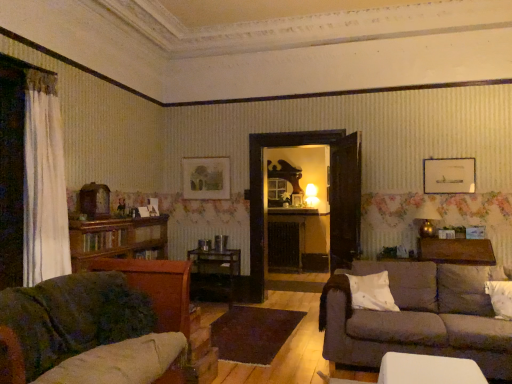
Question: Which direction should I rotate to look at matte wooden picture frame at upper center, the 2th picture frame positioned from the right?

Choices:
 (A) right
 (B) left

Answer: (B)

Question: Should I look upward or downward to see velvet green couch at lower left, the 2th studio couch in the right-to-left sequence?

Choices:
 (A) up
 (B) down

Answer: (B)

Question: Is velvet green couch at lower left, which is the first studio couch from front to back, positioned in front of white fabric pillow at lower right, which is counted as the second pillow, starting from the left?

Choices:
 (A) yes
 (B) no

Answer: (A)

Question: Is velvet green couch at lower left, arranged as the first studio couch when viewed from the left, not near white fabric pillow at lower right, the 1th pillow viewed from the right?

Choices:
 (A) no
 (B) yes

Answer: (B)

Question: Would you say white fabric pillow at lower right, which is counted as the second pillow, starting from the left, is part of velvet green couch at lower left, arranged as the 2th studio couch when viewed from the back,'s contents?

Choices:
 (A) yes
 (B) no

Answer: (B)

Question: Can you confirm if velvet green couch at lower left, arranged as the first studio couch when viewed from the left, is smaller than white fabric pillow at lower right, which is counted as the second pillow, starting from the left?

Choices:
 (A) yes
 (B) no

Answer: (B)

Question: Considering the relative sizes of velvet green couch at lower left, the 2th studio couch in the right-to-left sequence, and white fabric pillow at lower right, which is counted as the second pillow, starting from the left, in the image provided, is velvet green couch at lower left, the 2th studio couch in the right-to-left sequence, wider than white fabric pillow at lower right, which is counted as the second pillow, starting from the left,?

Choices:
 (A) no
 (B) yes

Answer: (B)

Question: Is velvet green couch at lower left, which is the first studio couch from front to back, at the left side of white fabric pillow at lower right, the 1th pillow viewed from the right?

Choices:
 (A) no
 (B) yes

Answer: (B)

Question: From the image's perspective, does matte white picture frame at upper right, which ranks as the second picture frame in back-to-front order, appear higher than velvet green couch at lower left, the 2th studio couch in the right-to-left sequence?

Choices:
 (A) yes
 (B) no

Answer: (A)

Question: Is matte white picture frame at upper right, which is the 1th picture frame in right-to-left order, positioned with its back to velvet green couch at lower left, arranged as the first studio couch when viewed from the left?

Choices:
 (A) no
 (B) yes

Answer: (A)

Question: Considering the relative sizes of matte white picture frame at upper right, which ranks as the second picture frame in back-to-front order, and velvet green couch at lower left, arranged as the 2th studio couch when viewed from the back, in the image provided, is matte white picture frame at upper right, which ranks as the second picture frame in back-to-front order, taller than velvet green couch at lower left, arranged as the 2th studio couch when viewed from the back,?

Choices:
 (A) no
 (B) yes

Answer: (A)

Question: Would you consider matte white picture frame at upper right, which is the 1th picture frame in right-to-left order, to be distant from velvet green couch at lower left, arranged as the first studio couch when viewed from the left?

Choices:
 (A) yes
 (B) no

Answer: (A)

Question: From the image's perspective, would you say matte white picture frame at upper right, the second picture frame from the left, is shown under velvet green couch at lower left, the 2th studio couch in the right-to-left sequence?

Choices:
 (A) yes
 (B) no

Answer: (B)

Question: From a real-world perspective, is matte white picture frame at upper right, the second picture frame from the left, on velvet green couch at lower left, arranged as the first studio couch when viewed from the left?

Choices:
 (A) yes
 (B) no

Answer: (A)

Question: Is velvet green couch at lower left, arranged as the 2th studio couch when viewed from the back, located outside white matte pillow at center, the second pillow positioned from the right?

Choices:
 (A) no
 (B) yes

Answer: (B)